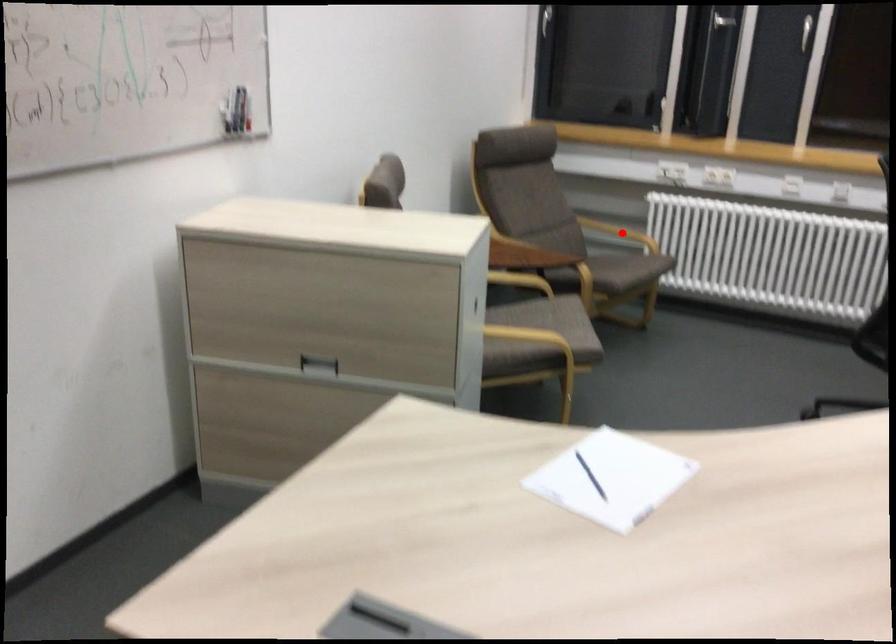
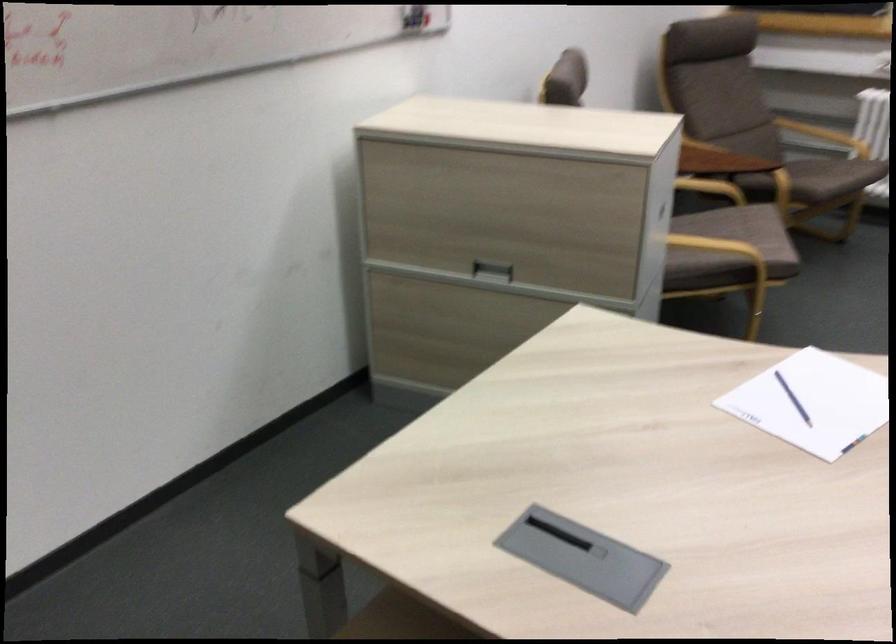
Question: I am providing you with two images of the same scene from different viewpoints. A red point is marked on the first image. At the location where the point appears in image 1, is it still visible in image 2?

Choices:
 (A) Yes
 (B) No

Answer: (A)